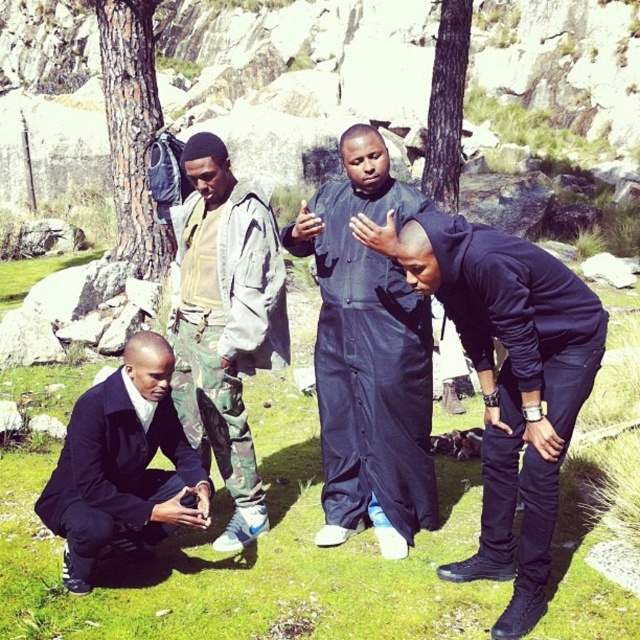
You are a photographer trying to capture a candid shot of the two people at the lower left of the scene. The camouflage fabric pants at lower left and the matte black suit at lower left are both in your viewfinder. Since you want to ensure both are clearly visible, which one should you focus on first considering their sizes?

The camouflage fabric pants at lower left is larger in size than the matte black suit at lower left, so you should focus on the camouflage fabric pants at lower left first to ensure clarity.

You are a photographer trying to capture a candid shot of the two people at the lower left of the scene. The camera you are using has a limited depth of field, so you can only focus on one object at a time. If you want to ensure that the camouflage fabric pants at lower left and the matte black suit at lower left are both in focus, which one should you focus on and why?

You should focus on the camouflage fabric pants at lower left because it has a greater height compared to the matte black suit at lower left, so focusing on the closer object will ensure both are in focus.

You are planning to take a photo of the black matte jumpsuit at center and the green grass at center. Which object should you focus on first if you want both to be in sharp focus?

The black matte jumpsuit at center is behind the green grass at center, so you should focus on the green grass at center first to ensure both are in sharp focus.